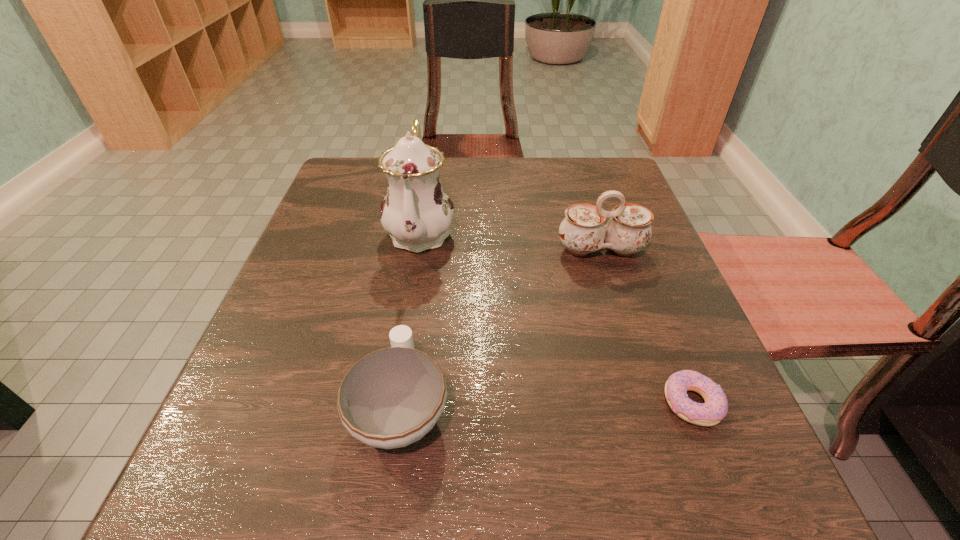
I want to click on vacant space that satisfies the following two spatial constraints: 1. by the handle of the shortest object; 2. on the right side of the rightmost chinaware, so click(x=649, y=403).